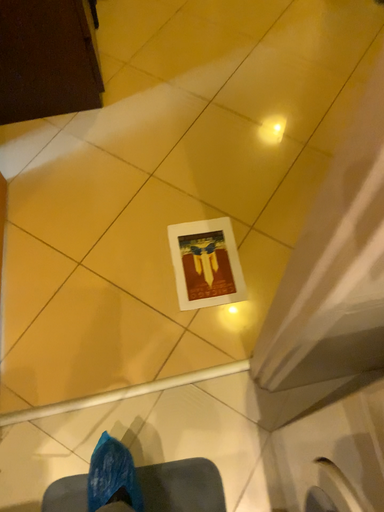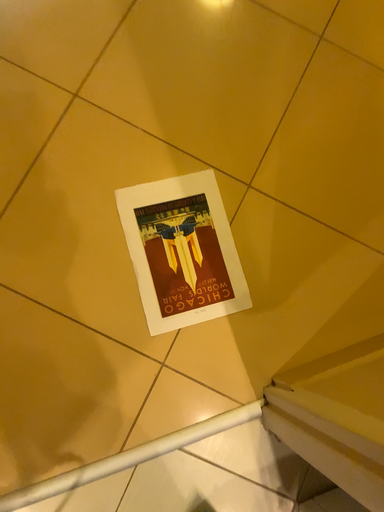
Question: Which way did the camera rotate in the video?

Choices:
 (A) rotated downward
 (B) rotated upward

Answer: (A)